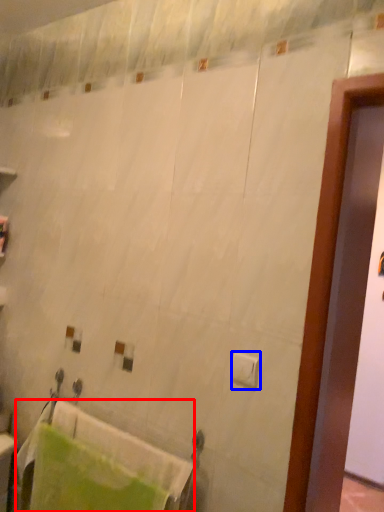
Question: Which object appears farthest to the camera in this image, bath towel (highlighted by a red box) or toilet paper (highlighted by a blue box)?

Choices:
 (A) bath towel
 (B) toilet paper

Answer: (A)